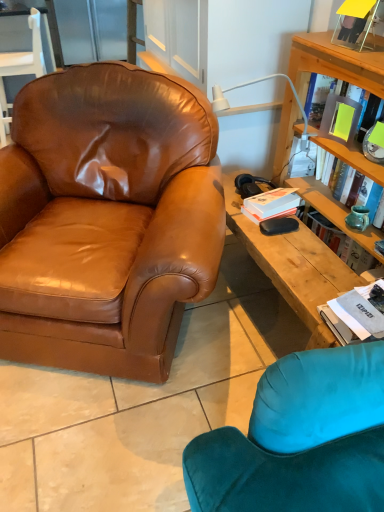
Describe the element at coordinates (356, 314) in the screenshot. This screenshot has width=384, height=512. I see `white paper book at right, which appears as the 2th book when viewed from the top` at that location.

Image resolution: width=384 pixels, height=512 pixels. Describe the element at coordinates (334, 211) in the screenshot. I see `matte teal vase at upper right` at that location.

Identify the location of white plastic lamp at upper right. Image resolution: width=384 pixels, height=512 pixels. (255, 83).

Looking at this image, what is the approximate height of yellow matte book at upper right, the second book in the bottom-to-top sequence?

yellow matte book at upper right, the second book in the bottom-to-top sequence, is 25.87 centimeters in height.

Image resolution: width=384 pixels, height=512 pixels. Describe the element at coordinates (107, 219) in the screenshot. I see `brown leather chair at left, the second chair from the left` at that location.

Measure the distance between point [281,203] and camera.

Point [281,203] and camera are 1.80 meters apart from each other.

Where is `white paper book at right, the second book when ordered from back to front`? This screenshot has width=384, height=512. white paper book at right, the second book when ordered from back to front is located at coordinates (356, 314).

Considering the relative positions of white paper book at right, acting as the 1th book starting from the front, and yellow matte book at upper right, the 1th book when ordered from back to front, in the image provided, is white paper book at right, acting as the 1th book starting from the front, to the right of yellow matte book at upper right, the 1th book when ordered from back to front, from the viewer's perspective?

In fact, white paper book at right, acting as the 1th book starting from the front, is to the left of yellow matte book at upper right, the 1th book when ordered from back to front.

Is white paper book at right, which is counted as the 1th book, starting from the bottom, next to yellow matte book at upper right, the 1th book when ordered from back to front?

white paper book at right, which is counted as the 1th book, starting from the bottom, is not next to yellow matte book at upper right, the 1th book when ordered from back to front, and they're not touching.

Is white paper book at right, acting as the 1th book starting from the front, inside or outside of yellow matte book at upper right, the 1th book when ordered from back to front?

The correct answer is: outside.

From a real-world perspective, is white paper book at right, which is counted as the 1th book, starting from the bottom, positioned above or below yellow matte book at upper right, placed as the 2th book when sorted from front to back?

From a real-world perspective, white paper book at right, which is counted as the 1th book, starting from the bottom, is physically below yellow matte book at upper right, placed as the 2th book when sorted from front to back.

Is yellow matte book at upper right, the second book in the bottom-to-top sequence, in front of or behind matte teal vase at upper right in the image?

Visually, yellow matte book at upper right, the second book in the bottom-to-top sequence, is located behind matte teal vase at upper right.

Is yellow matte book at upper right, the second book in the bottom-to-top sequence, taller or shorter than matte teal vase at upper right?

yellow matte book at upper right, the second book in the bottom-to-top sequence, is taller than matte teal vase at upper right.

From a real-world perspective, who is located lower, yellow matte book at upper right, the second book in the bottom-to-top sequence, or matte teal vase at upper right?

matte teal vase at upper right.

Is yellow matte book at upper right, the second book in the bottom-to-top sequence, completely or partially outside of matte teal vase at upper right?

That's correct, yellow matte book at upper right, the second book in the bottom-to-top sequence, is outside of matte teal vase at upper right.

Considering the relative sizes of teal ceramic vase at right and matte teal vase at upper right in the image provided, is teal ceramic vase at right shorter than matte teal vase at upper right?

Yes.

From the picture: From the image's perspective, between teal ceramic vase at right and matte teal vase at upper right, who is located below?

teal ceramic vase at right.

What's the angular difference between teal ceramic vase at right and matte teal vase at upper right's facing directions?

teal ceramic vase at right and matte teal vase at upper right are facing 0.00103 degrees away from each other.

Can matte teal vase at upper right be found inside teal ceramic vase at right?

No.

From the picture: Is brown leather chair at left, the second chair from the left, to the left of white plastic lamp at upper right from the viewer's perspective?

Correct, you'll find brown leather chair at left, the second chair from the left, to the left of white plastic lamp at upper right.

This screenshot has height=512, width=384. In order to click on chair below the white plastic lamp at upper right (from the image's perspective) in this screenshot , I will do `click(107, 219)`.

From the image's perspective, would you say brown leather chair at left, the second chair from the left, is shown under white plastic lamp at upper right?

Yes, from the image's perspective, brown leather chair at left, the second chair from the left, is beneath white plastic lamp at upper right.

From a real-world perspective, between brown leather chair at left, placed as the second chair when sorted from back to front, and white plastic lamp at upper right, who is vertically higher?

white plastic lamp at upper right.

Is point (38, 50) farther from camera compared to point (328, 304)?

That is True.

From the image's perspective, who appears lower, brown leather armchair at upper left, which is counted as the second chair, starting from the right, or white paper book at right, which is counted as the 1th book, starting from the bottom?

white paper book at right, which is counted as the 1th book, starting from the bottom.

In the scene shown: Considering the sizes of objects brown leather armchair at upper left, which is the first chair in left-to-right order, and white paper book at right, which appears as the 2th book when viewed from the top, in the image provided, who is smaller, brown leather armchair at upper left, which is the first chair in left-to-right order, or white paper book at right, which appears as the 2th book when viewed from the top,?

white paper book at right, which appears as the 2th book when viewed from the top.

From the image's perspective, which one is positioned higher, white paper book at right, acting as the 1th book starting from the front, or brown leather armchair at upper left, placed as the 2th chair when sorted from bottom to top?

brown leather armchair at upper left, placed as the 2th chair when sorted from bottom to top, from the image's perspective.

How distant is white paper book at right, acting as the 1th book starting from the front, from brown leather armchair at upper left, which is counted as the second chair, starting from the right?

2.78 meters.

Between point (380, 312) and point (34, 46), which one is positioned behind?

The point (34, 46) is farther.

From a real-world perspective, is white paper book at right, the second book when ordered from back to front, positioned above or below brown leather armchair at upper left, the first chair positioned from the top?

In terms of real-world spatial position, white paper book at right, the second book when ordered from back to front, is above brown leather armchair at upper left, the first chair positioned from the top.

Which object is more forward, matte teal vase at upper right or white paper book at right, which is counted as the 1th book, starting from the bottom?

Positioned in front is white paper book at right, which is counted as the 1th book, starting from the bottom.

Are matte teal vase at upper right and white paper book at right, which is counted as the 1th book, starting from the bottom, making contact?

No, matte teal vase at upper right is not beside white paper book at right, which is counted as the 1th book, starting from the bottom.

Is matte teal vase at upper right positioned with its back to white paper book at right, the second book when ordered from back to front?

No.

Considering the relative sizes of matte teal vase at upper right and white paper book at right, acting as the 1th book starting from the front, in the image provided, is matte teal vase at upper right wider than white paper book at right, acting as the 1th book starting from the front,?

No, matte teal vase at upper right is not wider than white paper book at right, acting as the 1th book starting from the front.

The width and height of the screenshot is (384, 512). Find the location of `book on the right of the white paper book at right, acting as the 1th book starting from the front`. book on the right of the white paper book at right, acting as the 1th book starting from the front is located at coordinates (340, 118).

I want to click on book positioned vertically above the matte teal vase at upper right (from a real-world perspective), so click(x=340, y=118).

Estimate the real-world distances between objects in this image. Which object is closer to matte teal vase at upper right, brown leather chair at left, placed as the second chair when sorted from back to front, or teal ceramic vase at right?

Among the two, teal ceramic vase at right is located nearer to matte teal vase at upper right.

From the image, which object appears to be farther from brown leather armchair at upper left, which is counted as the second chair, starting from the right, white matte paperback book at upper right or teal ceramic vase at right?

Among the two, teal ceramic vase at right is located further to brown leather armchair at upper left, which is counted as the second chair, starting from the right.

Considering their positions, is white matte paperback book at upper right positioned closer to white plastic lamp at upper right than white paper book at right, the second book when ordered from back to front?

white matte paperback book at upper right is positioned closer to the anchor white plastic lamp at upper right.

Based on their spatial positions, is yellow matte book at upper right, which is counted as the first book, starting from the top, or brown leather chair at left, the 1th chair from the right, further from white plastic lamp at upper right?

Among the two, brown leather chair at left, the 1th chair from the right, is located further to white plastic lamp at upper right.

Considering their positions, is yellow matte book at upper right, the 1th book when ordered from back to front, positioned closer to white plastic lamp at upper right than white paper book at right, which appears as the 2th book when viewed from the top?

yellow matte book at upper right, the 1th book when ordered from back to front.

Looking at the image, which one is located further to white plastic lamp at upper right, white paper book at right, the second book when ordered from back to front, or teal ceramic vase at right?

white paper book at right, the second book when ordered from back to front, is positioned further to the anchor white plastic lamp at upper right.

Looking at this image, when comparing their distances from brown leather armchair at upper left, placed as the 2th chair when sorted from bottom to top, does matte teal vase at upper right or white plastic lamp at upper right seem further?

matte teal vase at upper right.

From the image, which object appears to be farther from matte teal vase at upper right, yellow matte book at upper right, the second book in the bottom-to-top sequence, or teal ceramic vase at right?

Among the two, yellow matte book at upper right, the second book in the bottom-to-top sequence, is located further to matte teal vase at upper right.

The height and width of the screenshot is (512, 384). Find the location of `shelf between brown leather chair at left, the 1th chair in the front-to-back sequence, and teal ceramic vase at right, in the horizontal direction`. shelf between brown leather chair at left, the 1th chair in the front-to-back sequence, and teal ceramic vase at right, in the horizontal direction is located at coordinates (334, 211).

I want to click on lamp located between brown leather chair at left, which is counted as the 2th chair, starting from the top, and matte teal vase at upper right in the left-right direction, so click(255, 83).

The image size is (384, 512). I want to click on lamp between brown leather chair at left, the second chair from the left, and brown leather armchair at upper left, placed as the 2th chair when sorted from bottom to top, in the front-back direction, so click(x=255, y=83).

Locate an element on the screen. The width and height of the screenshot is (384, 512). paperback book situated between brown leather armchair at upper left, which is the first chair in left-to-right order, and white paper book at right, which is counted as the 1th book, starting from the bottom, from left to right is located at coordinates (271, 204).